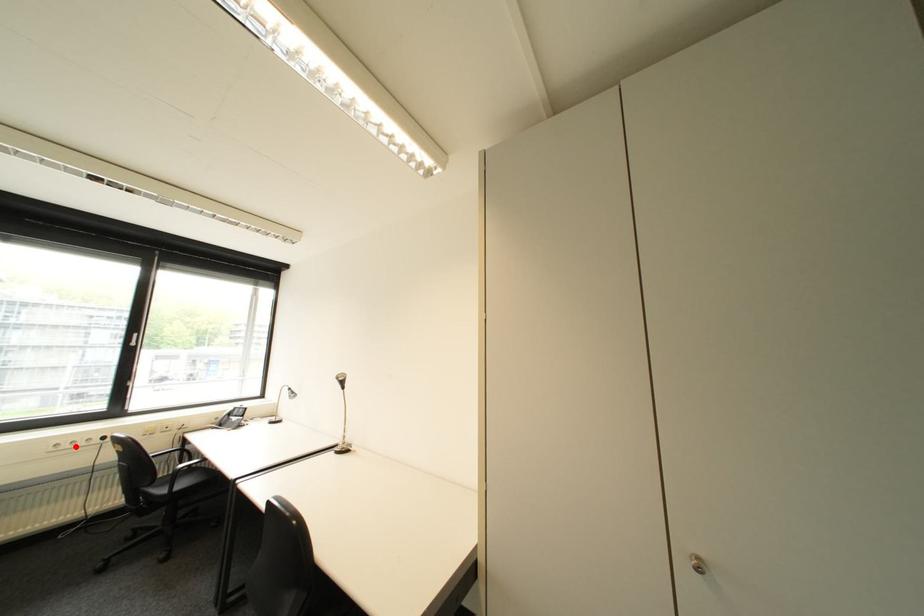
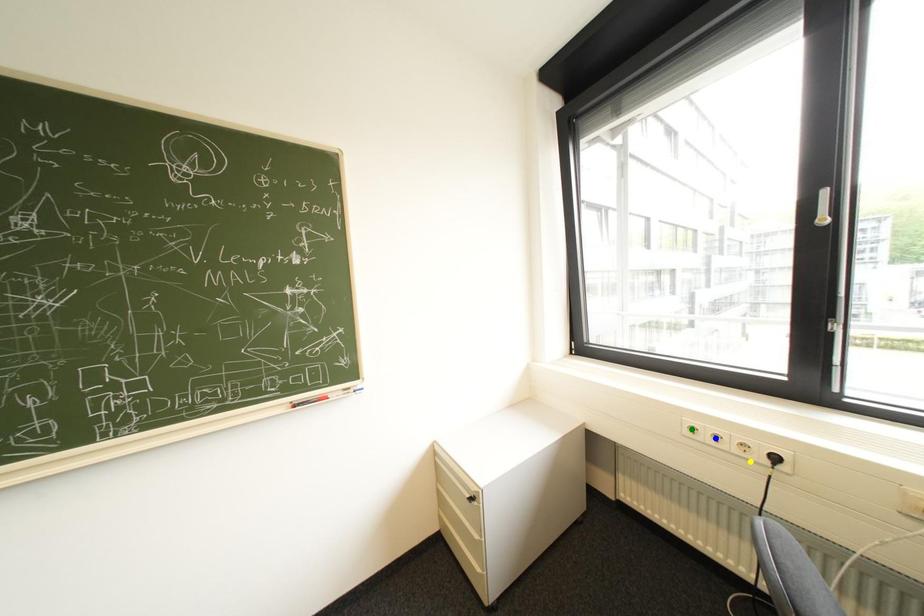
Question: I am providing you with two images of the same scene from different viewpoints. A red point is marked on the first image. You are given multiple points on the second image. Which spot in image 2 lines up with the point in image 1?

Choices:
 (A) green point
 (B) yellow point
 (C) blue point

Answer: (C)